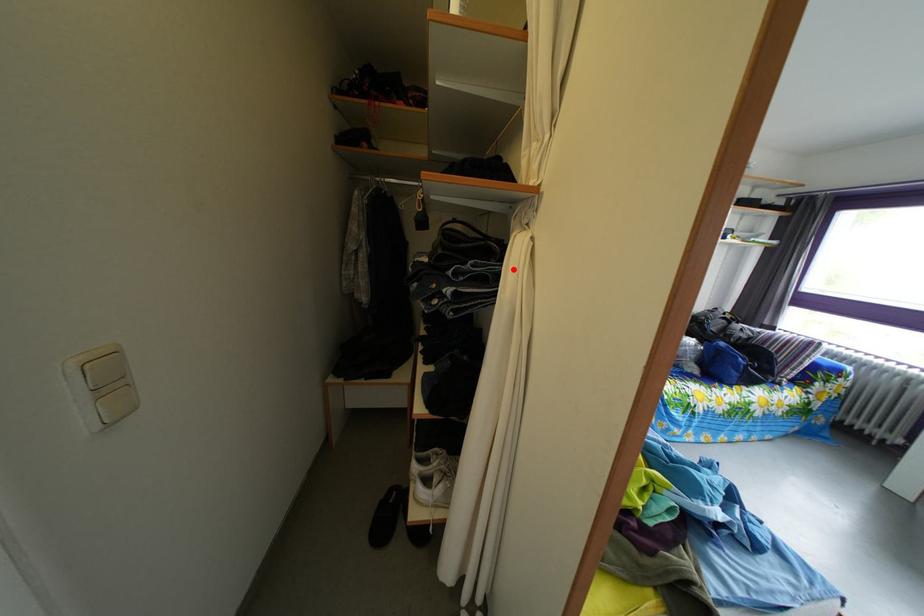
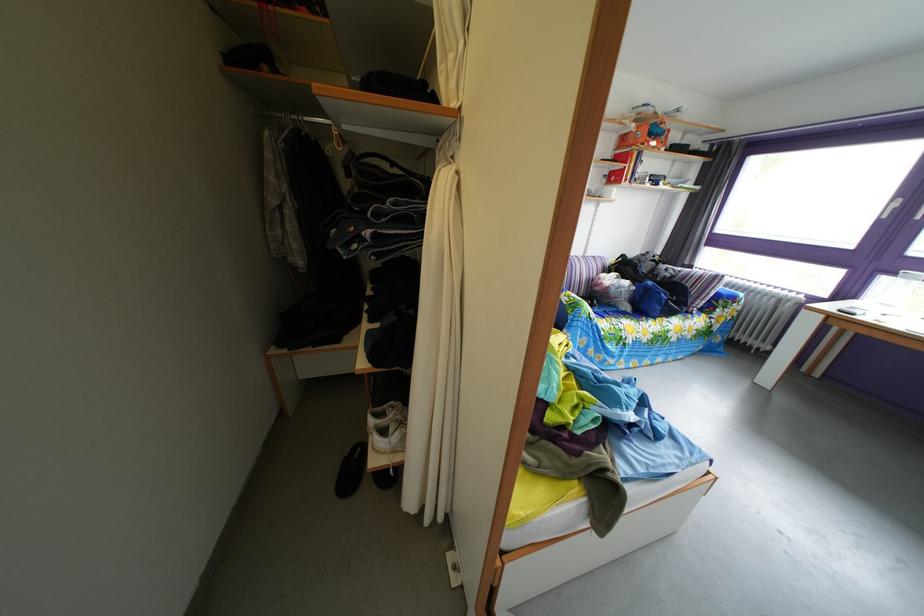
Find the pixel in the second image that matches the highlighted location in the first image.

(438, 207)